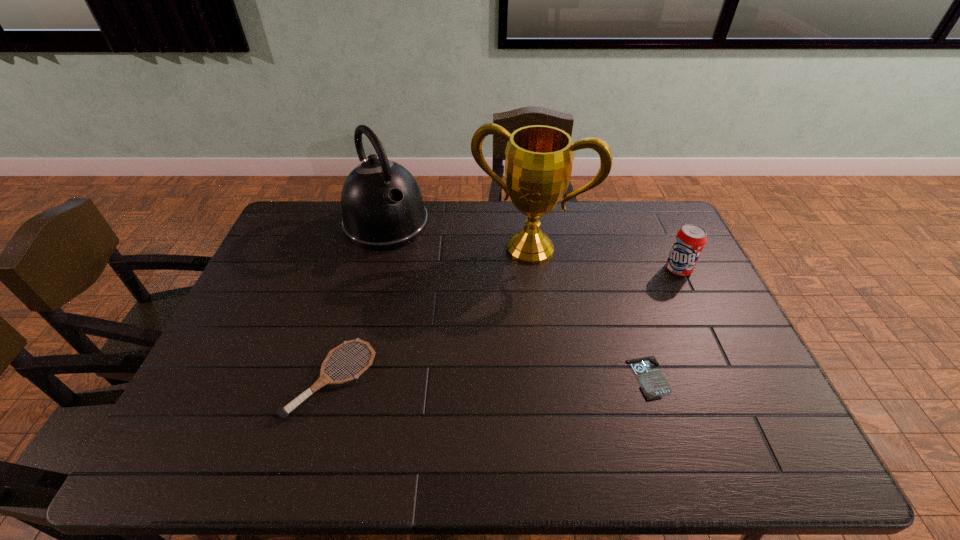
This screenshot has height=540, width=960. Find the location of `vacant space in between the second object from right to left and the third object from right to left`. vacant space in between the second object from right to left and the third object from right to left is located at coordinates (589, 313).

Identify the location of free space between the fourth tallest object and the soda can. The width and height of the screenshot is (960, 540). (505, 324).

Where is `unoccupied area between the rightmost object and the tennis racket`? This screenshot has width=960, height=540. unoccupied area between the rightmost object and the tennis racket is located at coordinates click(x=505, y=324).

Locate an element on the screen. The width and height of the screenshot is (960, 540). free space between the award and the rightmost object is located at coordinates (605, 259).

This screenshot has height=540, width=960. What are the coordinates of `free space between the award and the shortest object` in the screenshot? It's located at (589, 313).

Identify the location of free spot between the fourth shortest object and the identity card. The image size is (960, 540). (517, 301).

This screenshot has width=960, height=540. I want to click on unoccupied position between the fourth tallest object and the third shortest object, so click(x=505, y=324).

Image resolution: width=960 pixels, height=540 pixels. In order to click on free area in between the third tallest object and the award in this screenshot , I will do `click(605, 259)`.

Identify the location of free space between the third object from right to left and the rightmost object. (605, 259).

Identify which object is the third closest to the second shortest object. Please provide its 2D coordinates. Your answer should be formatted as a tuple, i.e. [(x, y)], where the tuple contains the x and y coordinates of a point satisfying the conditions above.

[(654, 385)]